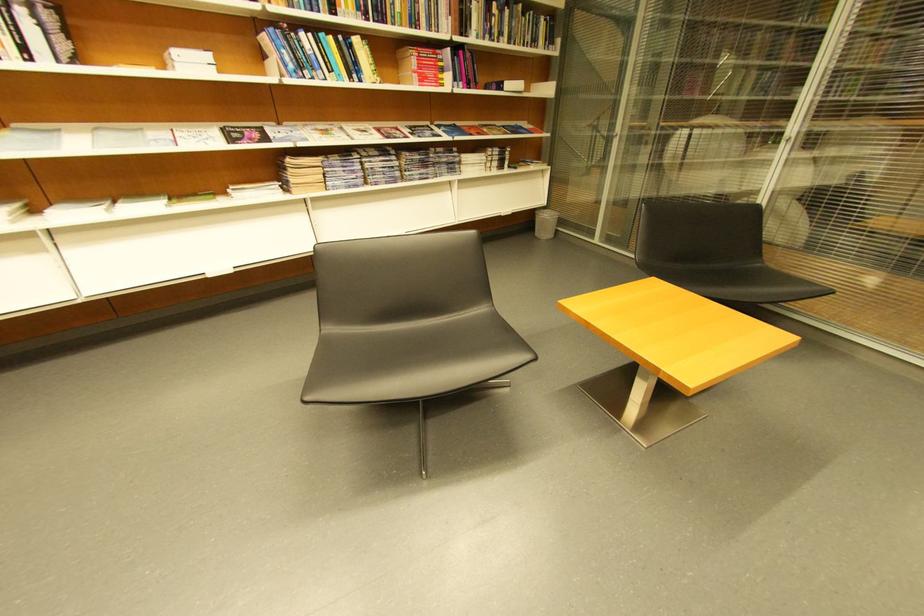
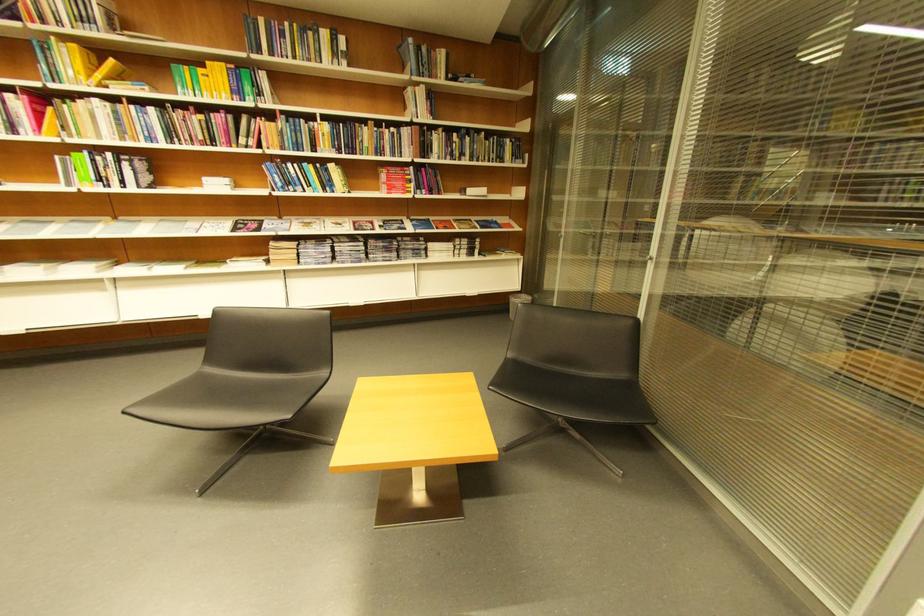
Find the pixel in the second image that matches point 301,69 in the first image.

(290, 185)